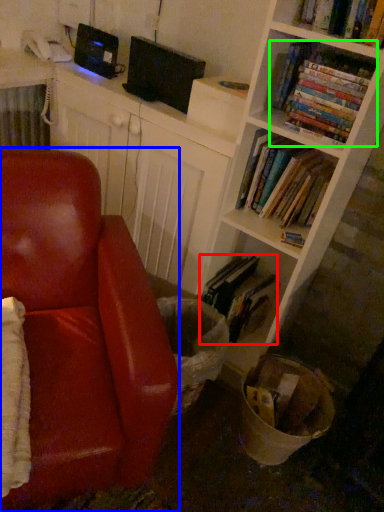
Question: Based on their relative distances, which object is farther from book (highlighted by a red box)? Choose from chair (highlighted by a blue box) and book (highlighted by a green box).

Choices:
 (A) chair
 (B) book

Answer: (B)